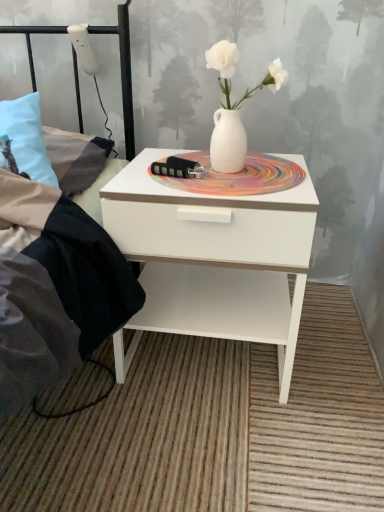
Question: Considering the relative positions of black metal bed frame at upper left and white glossy nightstand at center in the image provided, is black metal bed frame at upper left in front of white glossy nightstand at center?

Choices:
 (A) yes
 (B) no

Answer: (A)

Question: Does black metal bed frame at upper left have a lesser width compared to white glossy nightstand at center?

Choices:
 (A) yes
 (B) no

Answer: (B)

Question: From the image's perspective, is black metal bed frame at upper left located beneath white glossy nightstand at center?

Choices:
 (A) yes
 (B) no

Answer: (B)

Question: Is white glossy nightstand at center located within black metal bed frame at upper left?

Choices:
 (A) yes
 (B) no

Answer: (B)

Question: Can you confirm if black metal bed frame at upper left is wider than white glossy nightstand at center?

Choices:
 (A) yes
 (B) no

Answer: (A)

Question: From the image's perspective, would you say black metal bed frame at upper left is positioned over white glossy nightstand at center?

Choices:
 (A) yes
 (B) no

Answer: (A)

Question: Can you see white glossy nightstand at center touching black metal bed frame at upper left?

Choices:
 (A) yes
 (B) no

Answer: (B)

Question: Does white glossy nightstand at center have a smaller size compared to black metal bed frame at upper left?

Choices:
 (A) yes
 (B) no

Answer: (A)

Question: Could you tell me if white glossy nightstand at center is turned towards black metal bed frame at upper left?

Choices:
 (A) no
 (B) yes

Answer: (A)

Question: Considering the relative sizes of white glossy nightstand at center and black metal bed frame at upper left in the image provided, is white glossy nightstand at center taller than black metal bed frame at upper left?

Choices:
 (A) yes
 (B) no

Answer: (A)

Question: Is white glossy nightstand at center to the right of black metal bed frame at upper left from the viewer's perspective?

Choices:
 (A) yes
 (B) no

Answer: (A)

Question: Would you say white glossy nightstand at center contains black metal bed frame at upper left?

Choices:
 (A) yes
 (B) no

Answer: (B)

Question: Relative to black metal bed frame at upper left, is white glossy nightstand at center in front or behind?

Choices:
 (A) behind
 (B) front

Answer: (A)